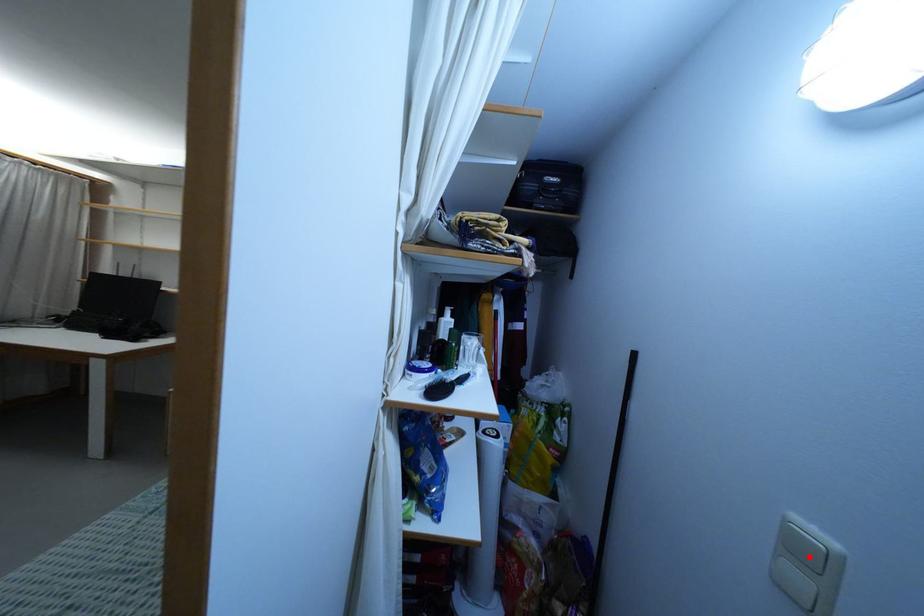
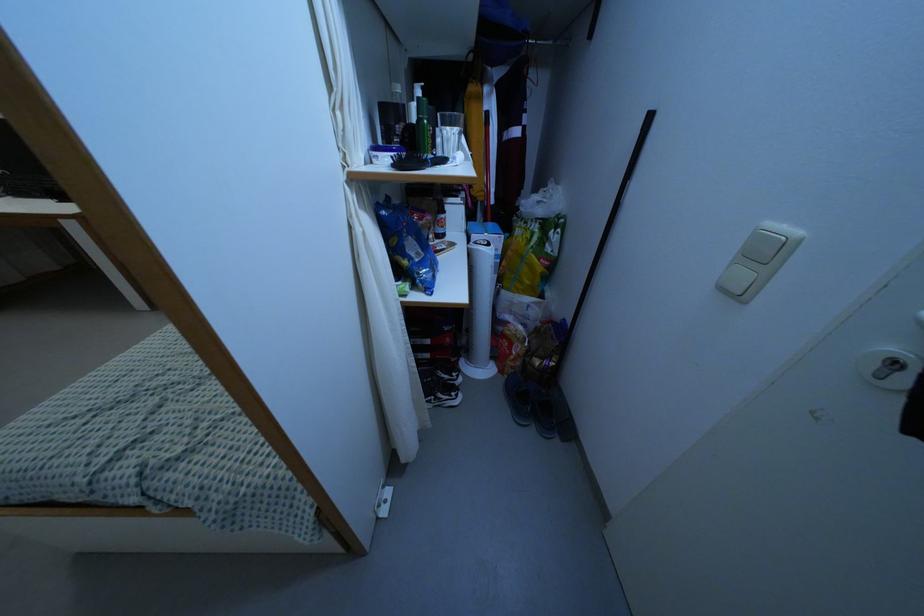
Where in the second image is the point corresponding to the highlighted location from the first image?

(762, 254)